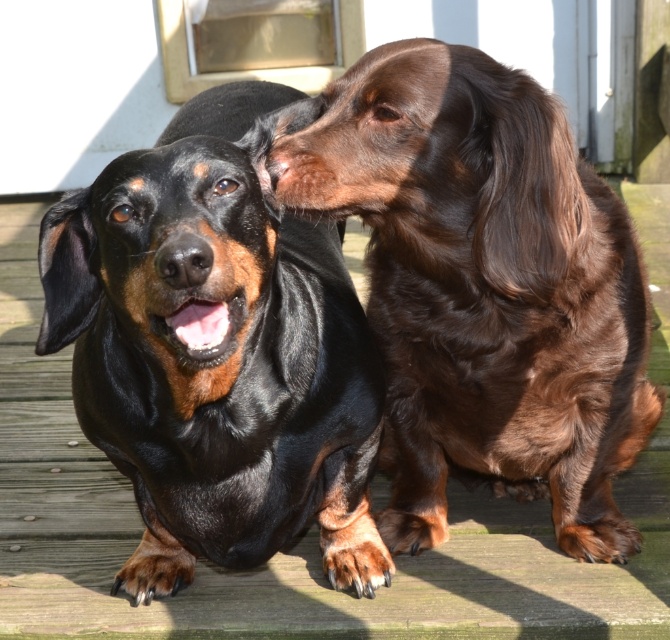
You are taking a photo of two dachshunds on a wooden deck. The camera is positioned at the same level as the dogs. You want to focus on the point closer to the camera to ensure the subject is sharp. Which point should you choose between point (402,141) and point (145,493)?

You should focus on point (402,141) because it is closer to the camera than point (145,493), ensuring the subject is in sharp focus.

You are a dog trainer observing two dogs on a wooden deck. You see the shiny brown fur at center and the black shiny fur dog at center. Can you determine if there is enough space between them to fit a 10 inch wide dog toy?

The shiny brown fur at center and black shiny fur dog at center are 10.17 inches apart, so yes, the 10 inch wide dog toy can fit between them since the distance is slightly larger than the toy.

You are a dog trainer assessing the space between two dogs on a wooden deck. The dogs are the shiny brown fur at center and the black shiny fur dog at center. Can you determine which dog is wider?

The shiny brown fur at center is wider than the black shiny fur dog at center according to the description.